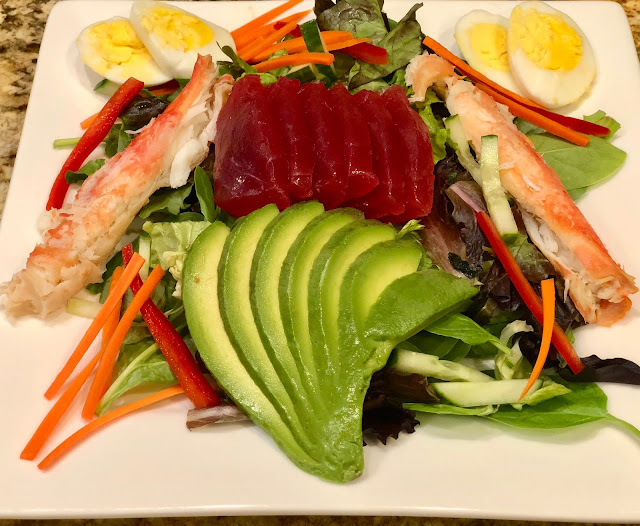
The width and height of the screenshot is (640, 526). I want to click on marble counter top, so click(12, 67).